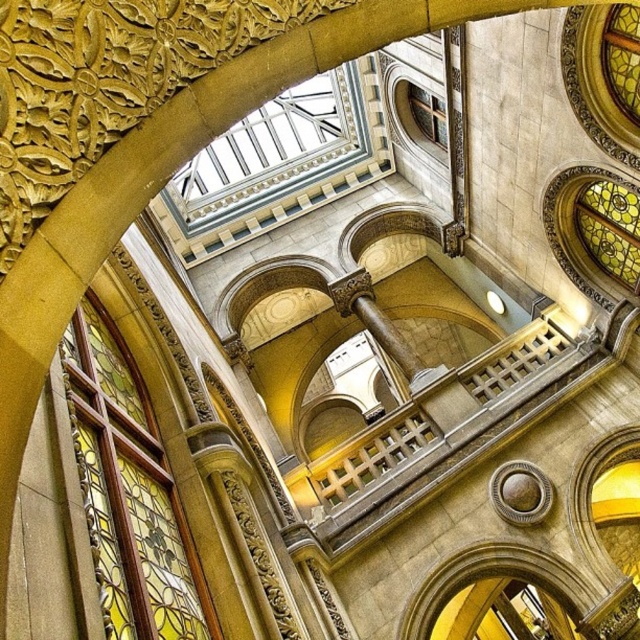
Question: Which object is the closest to the stained glass window at upper right?

Choices:
 (A) transparent glass ceiling at upper center
 (B) stained glass window at left

Answer: (B)

Question: Is stained glass window at left to the left of stained glass window at upper right from the viewer's perspective?

Choices:
 (A) no
 (B) yes

Answer: (B)

Question: Is stained glass window at left positioned in front of transparent glass ceiling at upper center?

Choices:
 (A) no
 (B) yes

Answer: (B)

Question: Among these objects, which one is farthest from the camera?

Choices:
 (A) stained glass window at left
 (B) stained glass window at upper right
 (C) clear glass window at upper center
 (D) transparent glass ceiling at upper center

Answer: (C)

Question: Which point is farther to the camera?

Choices:
 (A) (250, 115)
 (B) (172, 502)
 (C) (424, 112)

Answer: (A)

Question: Does transparent glass ceiling at upper center have a larger size compared to stained glass window at upper right?

Choices:
 (A) yes
 (B) no

Answer: (A)